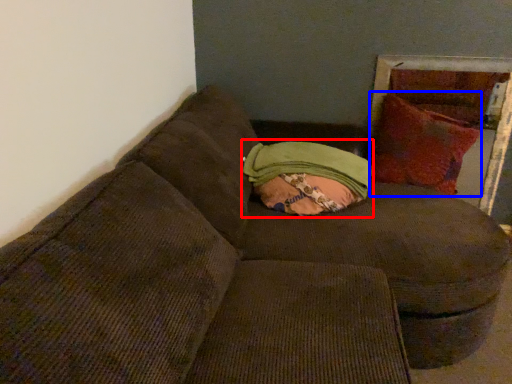
Question: Among these objects, which one is nearest to the camera, bean bag chair (highlighted by a red box) or throw pillow (highlighted by a blue box)?

Choices:
 (A) bean bag chair
 (B) throw pillow

Answer: (A)